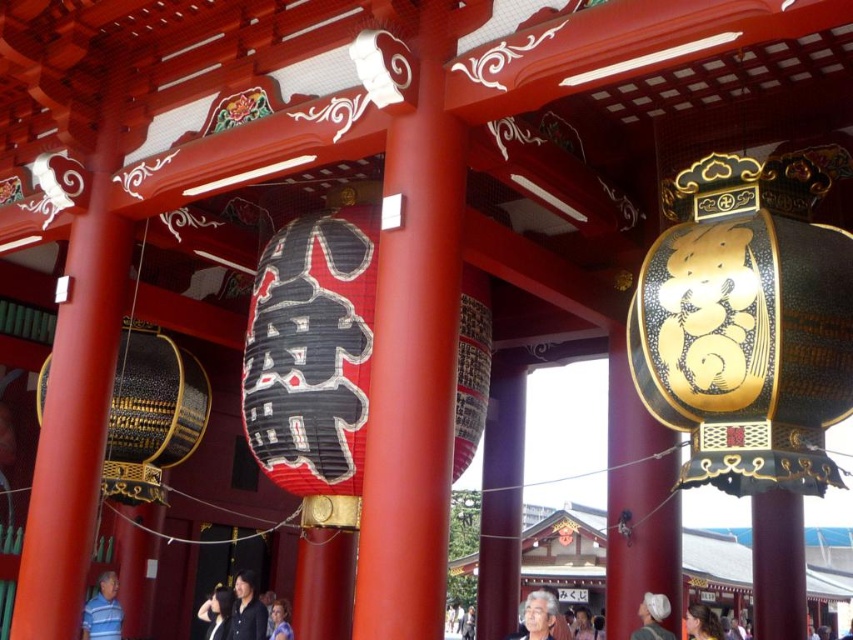
You are standing in front of the shrine entrance and see the dark blue fabric at center and the blue fabric shirt at center. Which one is positioned to the left?

The dark blue fabric at center is positioned to the left of the blue fabric shirt at center.

You are a visitor standing at the entrance of the shrine. You want to place a 7 meter long banner between the gold textured lantern at center and the white fabric cap at lower center. Will the banner fit without overlapping either object?

The distance between the gold textured lantern at center and the white fabric cap at lower center is 6.52 meters. Since the banner is 7 meters long, it will be 0.48 meters longer than the available space, so it will overlap both objects.

You are a visitor approaching the shrine entrance and notice the gold textured lantern at center and the white fabric cap at lower center. Which object is located above the other?

The gold textured lantern at center is positioned over the white fabric cap at lower center.